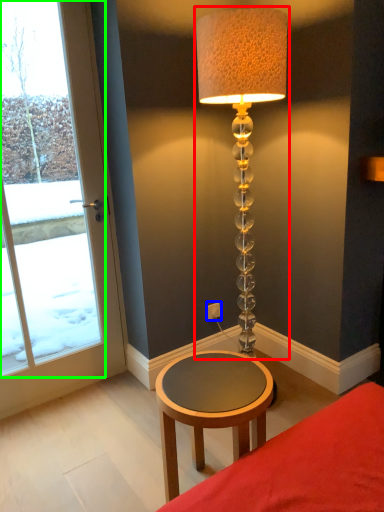
Question: Based on their relative distances, which object is farther from lamp (highlighted by a red box)? Choose from electric outlet (highlighted by a blue box) and window (highlighted by a green box).

Choices:
 (A) electric outlet
 (B) window

Answer: (B)